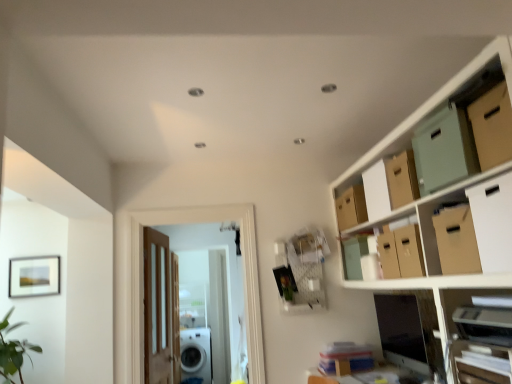
This screenshot has height=384, width=512. Identify the location of matte cardboard boxes at upper right. (436, 103).

Measure the distance between white glossy washing machine at lower center and camera.

white glossy washing machine at lower center and camera are 19.90 feet apart.

In order to face brown cardboard box at upper right, the third cardboard box in the back-to-front sequence, should I rotate leftwards or rightwards?

To align with it, rotate right about 30.794°.

Measure the distance between point (35,276) and camera.

The distance of point (35,276) from camera is 3.31 meters.

What do you see at coordinates (456, 241) in the screenshot? I see `brown cardboard box at upper right, positioned as the second cardboard box in back-to-front order` at bounding box center [456, 241].

This screenshot has height=384, width=512. What do you see at coordinates (479, 375) in the screenshot?
I see `white cardboard drawer at lower right` at bounding box center [479, 375].

The image size is (512, 384). What are the coordinates of `wooden shelf at lower right` in the screenshot? It's located at (453, 308).

Is mint green cardboard storage box at upper right, which is the 2th storage box in back-to-front order, to the left of matte cardboard boxes at upper right from the viewer's perspective?

No.

Is mint green cardboard storage box at upper right, which is the 2th storage box in back-to-front order, aimed at matte cardboard boxes at upper right?

Yes, mint green cardboard storage box at upper right, which is the 2th storage box in back-to-front order, is aimed at matte cardboard boxes at upper right.

Can we say mint green cardboard storage box at upper right, which is the 2th storage box in back-to-front order, lies outside matte cardboard boxes at upper right?

Actually, mint green cardboard storage box at upper right, which is the 2th storage box in back-to-front order, is at least partially inside matte cardboard boxes at upper right.

I want to click on storage box that is on the right side of matte cardboard boxes at upper right, so click(444, 150).

Considering the relative positions of white cardboard drawer at lower right and brown cardboard box at upper right, the third cardboard box in the back-to-front sequence, in the image provided, is white cardboard drawer at lower right to the right of brown cardboard box at upper right, the third cardboard box in the back-to-front sequence, from the viewer's perspective?

Yes.

Is white cardboard drawer at lower right facing away from brown cardboard box at upper right, the third cardboard box in the back-to-front sequence?

white cardboard drawer at lower right does not have its back to brown cardboard box at upper right, the third cardboard box in the back-to-front sequence.

Which object is wider, white cardboard drawer at lower right or brown cardboard box at upper right, the third cardboard box in the back-to-front sequence?

Wider between the two is brown cardboard box at upper right, the third cardboard box in the back-to-front sequence.

Is point (479, 368) closer to camera compared to point (498, 152)?

No, it is not.

Which object is wider, white cardboard box at upper right, which appears as the first cardboard box when viewed from the front, or white cardboard drawer at lower right?

white cardboard box at upper right, which appears as the first cardboard box when viewed from the front, is wider.

Considering the positions of point (485, 248) and point (477, 375), is point (485, 248) closer or farther from the camera than point (477, 375)?

Clearly, point (485, 248) is closer to the camera than point (477, 375).

From the image's perspective, relative to white cardboard drawer at lower right, is white cardboard box at upper right, which appears as the first cardboard box when viewed from the front, above or below?

From the image's perspective, white cardboard box at upper right, which appears as the first cardboard box when viewed from the front, appears above white cardboard drawer at lower right.

Based on the photo, from a real-world perspective, is white cardboard box at upper right, which appears as the first cardboard box when viewed from the front, located beneath white cardboard drawer at lower right?

Incorrect, from a real-world perspective, white cardboard box at upper right, which appears as the first cardboard box when viewed from the front, is higher than white cardboard drawer at lower right.

Is wooden shelf at lower right at the left side of brown cardboard box at upper right, the third cardboard box in the back-to-front sequence?

Incorrect, wooden shelf at lower right is not on the left side of brown cardboard box at upper right, the third cardboard box in the back-to-front sequence.

Between wooden shelf at lower right and brown cardboard box at upper right, marked as the second cardboard box in a front-to-back arrangement, which one is positioned in front?

wooden shelf at lower right is closer to the camera.

How many degrees apart are the facing directions of wooden shelf at lower right and brown cardboard box at upper right, the third cardboard box in the back-to-front sequence?

The angular difference between wooden shelf at lower right and brown cardboard box at upper right, the third cardboard box in the back-to-front sequence, is 6.2 degrees.

Is point (444, 341) farther from viewer compared to point (492, 122)?

Yes, point (444, 341) is farther from viewer.

Looking at this image, is matte cardboard boxes at upper right far from matte cardboard box at upper right, the 1th storage box when ordered from back to front?

matte cardboard boxes at upper right is actually quite close to matte cardboard box at upper right, the 1th storage box when ordered from back to front.

Based on the photo, from a real-world perspective, relative to matte cardboard box at upper right, which is the 2th storage box from front to back, is matte cardboard boxes at upper right vertically above or below?

From a real-world perspective, matte cardboard boxes at upper right is physically below matte cardboard box at upper right, which is the 2th storage box from front to back.

Could you tell me if matte cardboard boxes at upper right is turned towards matte cardboard box at upper right, the 1th storage box when ordered from back to front?

Yes, matte cardboard boxes at upper right is aimed at matte cardboard box at upper right, the 1th storage box when ordered from back to front.

Does matte cardboard boxes at upper right have a lesser width compared to matte cardboard box at upper right, the 1th storage box when ordered from back to front?

No, matte cardboard boxes at upper right is not thinner than matte cardboard box at upper right, the 1th storage box when ordered from back to front.

Does point (463, 257) appear closer or farther from the camera than point (502, 270)?

Point (463, 257) is farther from the camera than point (502, 270).

Based on their positions, is brown cardboard box at upper right, the 3th cardboard box when ordered from front to back, located to the left or right of white cardboard box at upper right, which appears as the first cardboard box when viewed from the front?

Based on their positions, brown cardboard box at upper right, the 3th cardboard box when ordered from front to back, is located to the left of white cardboard box at upper right, which appears as the first cardboard box when viewed from the front.

Is brown cardboard box at upper right, positioned as the second cardboard box in back-to-front order, inside or outside of white cardboard box at upper right, which is the fourth cardboard box from back to front?

The correct answer is: outside.

Is matte cardboard box at upper right, which is the 2th storage box from front to back, wider or thinner than wooden door at center, which ranks as the 1th door in left-to-right order?

matte cardboard box at upper right, which is the 2th storage box from front to back, is wider than wooden door at center, which ranks as the 1th door in left-to-right order.

How much distance is there between matte cardboard box at upper right, the 1th storage box when ordered from back to front, and wooden door at center, positioned as the second door in front-to-back order?

matte cardboard box at upper right, the 1th storage box when ordered from back to front, and wooden door at center, positioned as the second door in front-to-back order, are 1.78 meters apart.

Is matte cardboard box at upper right, which is the 2th storage box from front to back, positioned with its back to wooden door at center, positioned as the 2th door in right-to-left order?

No.

Is matte cardboard box at upper right, the 1th storage box when ordered from back to front, taller or shorter than wooden door at center, positioned as the 2th door in right-to-left order?

matte cardboard box at upper right, the 1th storage box when ordered from back to front, is shorter than wooden door at center, positioned as the 2th door in right-to-left order.

The image size is (512, 384). Find the location of `cabinetry below the mint green cardboard storage box at upper right, which is the 2th storage box in back-to-front order (from a real-world perspective)`. cabinetry below the mint green cardboard storage box at upper right, which is the 2th storage box in back-to-front order (from a real-world perspective) is located at coordinates (436, 103).

The height and width of the screenshot is (384, 512). What are the coordinates of `cardboard box that is the 1st object located in front of the white cardboard drawer at lower right` in the screenshot? It's located at (492, 126).

Which object lies further to the anchor point matte cardboard box at upper right, which is the 2th storage box from front to back, brown cardboard box at upper right, the third cardboard box in the back-to-front sequence, or mint green cardboard storage box at upper right, the 1th storage box when ordered from front to back?

brown cardboard box at upper right, the third cardboard box in the back-to-front sequence, lies further to matte cardboard box at upper right, which is the 2th storage box from front to back, than the other object.

Estimate the real-world distances between objects in this image. Which object is closer to white cardboard box at upper right, which appears as the first cardboard box when viewed from the front, matte cardboard box at upper right, which is the 2th storage box from front to back, or wooden door at center, which is counted as the 2th door, starting from the back?

The object closer to white cardboard box at upper right, which appears as the first cardboard box when viewed from the front, is matte cardboard box at upper right, which is the 2th storage box from front to back.

Based on their spatial positions, is brown cardboard box at upper right, the third cardboard box in the back-to-front sequence, or wooden door at center, positioned as the 2th door in right-to-left order, further from brown cardboard box at upper right, positioned as the second cardboard box in back-to-front order?

wooden door at center, positioned as the 2th door in right-to-left order.

Considering their positions, is matte cardboard boxes at upper right positioned further to brown cardboard box at upper right, the third cardboard box in the back-to-front sequence, than matte cardboard box at upper right, which is the 2th storage box from front to back?

matte cardboard box at upper right, which is the 2th storage box from front to back, is further to brown cardboard box at upper right, the third cardboard box in the back-to-front sequence.

Based on their spatial positions, is white cardboard box at upper right, which appears as the first cardboard box when viewed from the front, or white glossy washing machine at lower center further from matte cardboard box at upper right, the 1th storage box when ordered from back to front?

Among the two, white glossy washing machine at lower center is located further to matte cardboard box at upper right, the 1th storage box when ordered from back to front.

When comparing their distances from wooden shelf at lower right, does white cardboard box at upper right, which is the fourth cardboard box from back to front, or wooden door at center, which is the 1th door in front-to-back order, seem closer?

Among the two, white cardboard box at upper right, which is the fourth cardboard box from back to front, is located nearer to wooden shelf at lower right.

Looking at this image, looking at the image, which one is located further to matte black picture frame at upper left, matte cardboard box at upper right, which is the 2th storage box from front to back, or white cardboard drawer at lower right?

white cardboard drawer at lower right is positioned further to the anchor matte black picture frame at upper left.

Which object lies nearer to the anchor point white cardboard drawer at lower right, matte cardboard boxes at upper right or brown cardboard box at upper right, marked as the second cardboard box in a front-to-back arrangement?

brown cardboard box at upper right, marked as the second cardboard box in a front-to-back arrangement.

Image resolution: width=512 pixels, height=384 pixels. I want to click on storage box located between brown cardboard box at upper right, positioned as the second cardboard box in back-to-front order, and matte cardboard box at upper right, which is the 2th storage box from front to back, in the depth direction, so click(444, 150).

In order to click on storage box between wooden shelf at lower right and matte cardboard box at upper right, which is the 2th storage box from front to back, from front to back in this screenshot , I will do `click(444, 150)`.

Where is `picture frame positioned between white cardboard drawer at lower right and wooden door at center, arranged as the first door when viewed from the back, from near to far`? The height and width of the screenshot is (384, 512). picture frame positioned between white cardboard drawer at lower right and wooden door at center, arranged as the first door when viewed from the back, from near to far is located at coordinates (34, 276).

The width and height of the screenshot is (512, 384). What are the coordinates of `drawer between matte cardboard boxes at upper right and brown cardboard box at upper right, the 1th cardboard box positioned from the back, from front to back` in the screenshot? It's located at (479, 375).